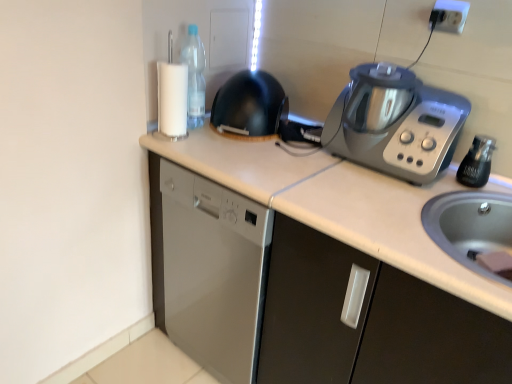
Find the location of a particular element. blank area to the left of black glass bottle at right, which is the 1th bottle from bottom to top is located at coordinates (415, 188).